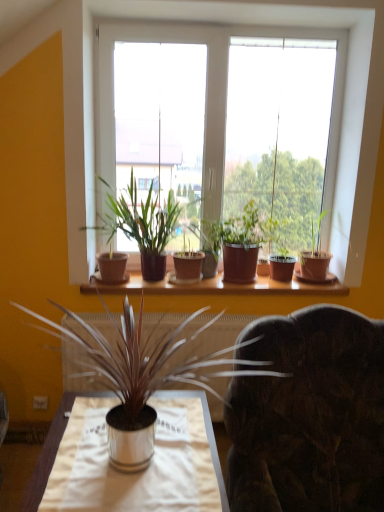
Question: Is wooden shelf at center outside brown clay pot at center, which is the 2th houseplant from front to back?

Choices:
 (A) yes
 (B) no

Answer: (A)

Question: Considering the relative positions of wooden shelf at center and brown clay pot at center, which is the 2th houseplant from front to back, in the image provided, is wooden shelf at center in front of brown clay pot at center, which is the 2th houseplant from front to back,?

Choices:
 (A) yes
 (B) no

Answer: (B)

Question: From the image's perspective, is wooden shelf at center above brown clay pot at center, which is the 2th houseplant from front to back?

Choices:
 (A) yes
 (B) no

Answer: (B)

Question: Does wooden shelf at center have a greater height compared to brown clay pot at center, which is the 2th houseplant from front to back?

Choices:
 (A) no
 (B) yes

Answer: (A)

Question: Is wooden shelf at center at the left side of brown clay pot at center, which is the 2th houseplant from front to back?

Choices:
 (A) yes
 (B) no

Answer: (B)

Question: From the image's perspective, is wooden shelf at center under brown clay pot at center, the fourth houseplant viewed from the back?

Choices:
 (A) yes
 (B) no

Answer: (A)

Question: Can you confirm if matte brown pot at center, the third houseplant viewed from the back, is bigger than green matte plant at upper right, the fourth houseplant viewed from the front?

Choices:
 (A) yes
 (B) no

Answer: (A)

Question: From a real-world perspective, is matte brown pot at center, the 3th houseplant in the front-to-back sequence, positioned under green matte plant at upper right, which appears as the second houseplant when viewed from the back, based on gravity?

Choices:
 (A) yes
 (B) no

Answer: (B)

Question: Are matte brown pot at center, the third houseplant viewed from the back, and green matte plant at upper right, which appears as the second houseplant when viewed from the back, located far from each other?

Choices:
 (A) yes
 (B) no

Answer: (B)

Question: Can you confirm if matte brown pot at center, the third houseplant viewed from the back, is thinner than green matte plant at upper right, which appears as the second houseplant when viewed from the back?

Choices:
 (A) no
 (B) yes

Answer: (A)

Question: Is matte brown pot at center, the 3th houseplant in the front-to-back sequence, wider than green matte plant at upper right, the fourth houseplant viewed from the front?

Choices:
 (A) yes
 (B) no

Answer: (A)

Question: Is matte brown pot at center, the 3th houseplant in the front-to-back sequence, not inside green matte plant at upper right, the fourth houseplant viewed from the front?

Choices:
 (A) no
 (B) yes

Answer: (B)

Question: Is brown clay pot at center, which is the 2th houseplant from front to back, completely or partially inside matte brown pot at center, the third houseplant viewed from the back?

Choices:
 (A) yes
 (B) no

Answer: (B)